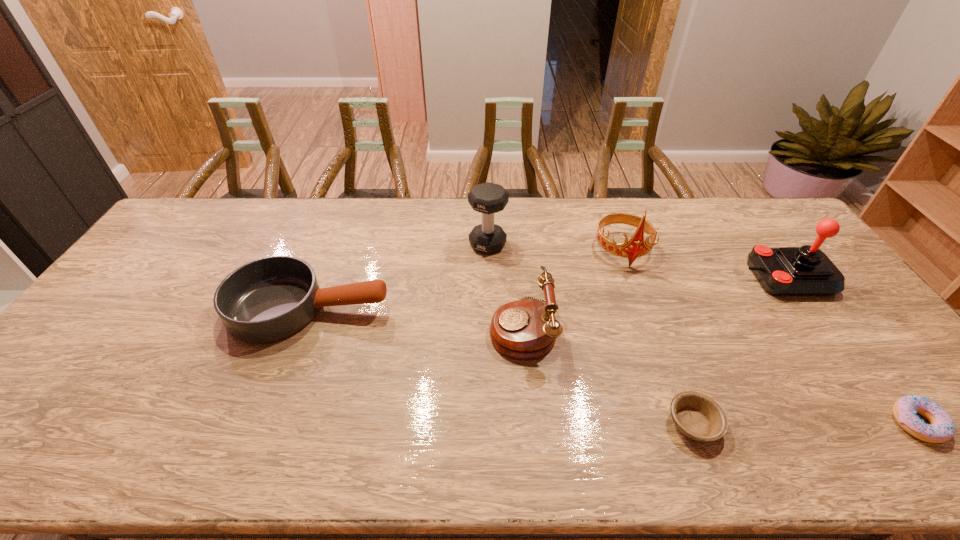
The height and width of the screenshot is (540, 960). Identify the location of tiara. (636, 247).

You are a GUI agent. You are given a task and a screenshot of the screen. Output one action in this format:
    pyautogui.click(x=<x>, y=<y>)
    Task: Click on the joystick
    
    Given the screenshot: What is the action you would take?
    pyautogui.click(x=786, y=271)

Identify the location of dumbbell. The image size is (960, 540). (487, 198).

Image resolution: width=960 pixels, height=540 pixels. In order to click on the fourth shortest object in this screenshot , I will do (525, 329).

This screenshot has width=960, height=540. I want to click on the leftmost object, so click(268, 299).

Image resolution: width=960 pixels, height=540 pixels. Identify the location of pan. (268, 299).

This screenshot has width=960, height=540. What are the coordinates of `doughnut` in the screenshot? It's located at (942, 428).

Identify the location of the shortest object. The width and height of the screenshot is (960, 540). (697, 416).

Find the location of a particular element. This screenshot has height=540, width=960. vacant space situated 0.290m on the front-facing side of the tiara is located at coordinates (658, 346).

At what (x,y) coordinates should I click in order to perform the action: click on vacant position located 0.110m on the base of the joystick. Please return your answer as a coordinate pair (x, y). The height and width of the screenshot is (540, 960). Looking at the image, I should click on (708, 278).